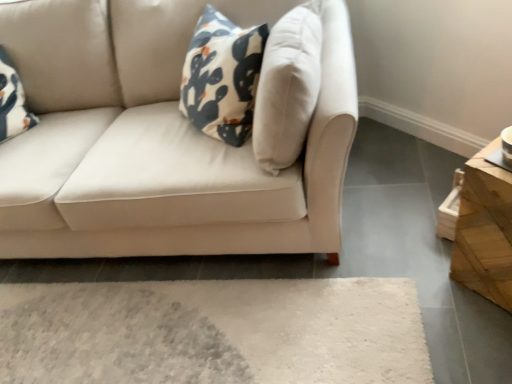
This screenshot has height=384, width=512. Find the location of `wooden side table at right`. wooden side table at right is located at coordinates (481, 228).

Describe the element at coordinates (481, 228) in the screenshot. Image resolution: width=512 pixels, height=384 pixels. I see `wooden side table at right` at that location.

Find the location of a particular element. The width and height of the screenshot is (512, 384). wooden side table at right is located at coordinates (481, 228).